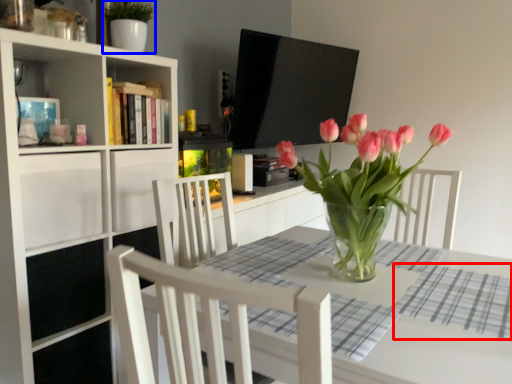
Question: Which of the following is the farthest to the observer, plaid (highlighted by a red box) or plant (highlighted by a blue box)?

Choices:
 (A) plaid
 (B) plant

Answer: (B)